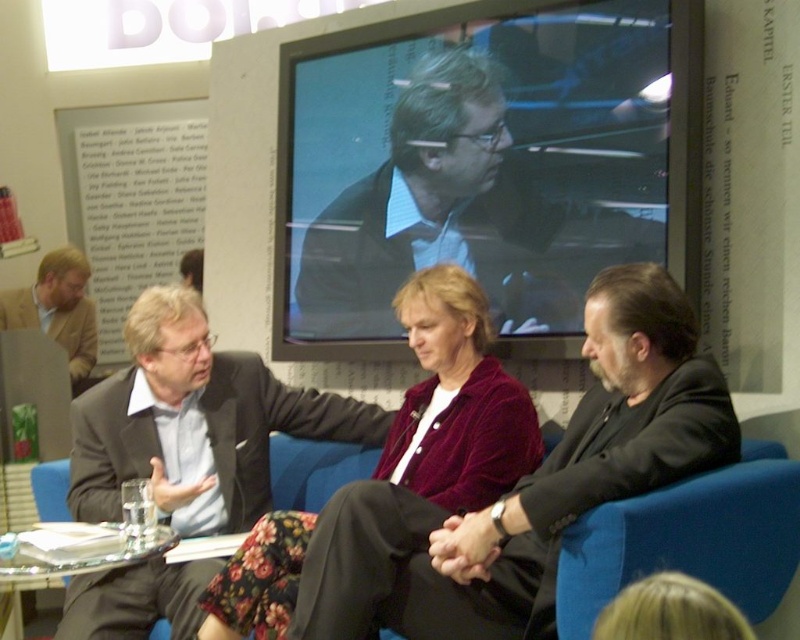
Can you confirm if black velvet suit at center is shorter than clear glass table at lower left?

No, black velvet suit at center is not shorter than clear glass table at lower left.

Does black velvet suit at center have a larger size compared to clear glass table at lower left?

Indeed, black velvet suit at center has a larger size compared to clear glass table at lower left.

Where is `black velvet suit at center`? black velvet suit at center is located at coordinates (504, 522).

The width and height of the screenshot is (800, 640). In order to click on black velvet suit at center in this screenshot , I will do `click(504, 522)`.

Which is in front, point (337, 200) or point (572, 534)?

Point (572, 534) is in front.

Image resolution: width=800 pixels, height=640 pixels. What do you see at coordinates (424, 204) in the screenshot? I see `matte black suit at center` at bounding box center [424, 204].

Image resolution: width=800 pixels, height=640 pixels. Identify the location of matte black suit at center. (424, 204).

Can you confirm if black velvet suit at center is positioned to the right of matte black suit at center?

Yes, black velvet suit at center is to the right of matte black suit at center.

Is black velvet suit at center bigger than matte black suit at center?

Incorrect, black velvet suit at center is not larger than matte black suit at center.

Locate an element on the screen. Image resolution: width=800 pixels, height=640 pixels. black velvet suit at center is located at coordinates (504, 522).

Identify the location of black velvet suit at center. This screenshot has width=800, height=640. (504, 522).